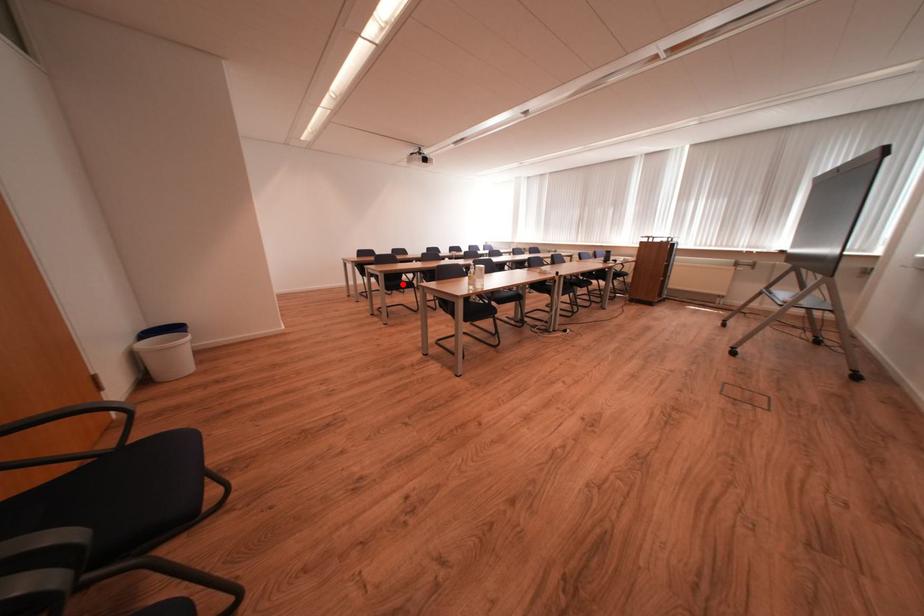
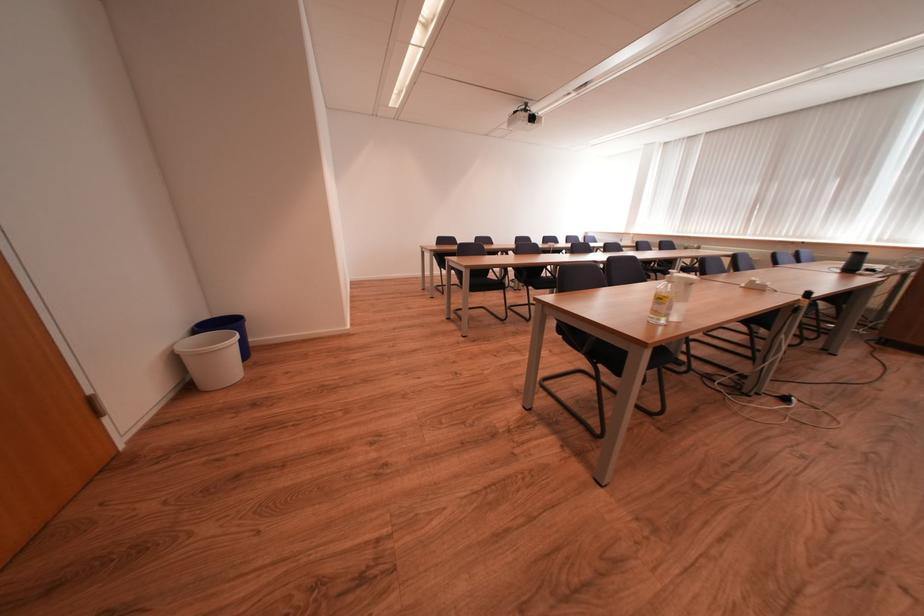
Question: I am providing you with two images of the same scene from different viewpoints. A red point is marked on the first image. Can you still see the location of the red point in image 2?

Choices:
 (A) Yes
 (B) No

Answer: (A)